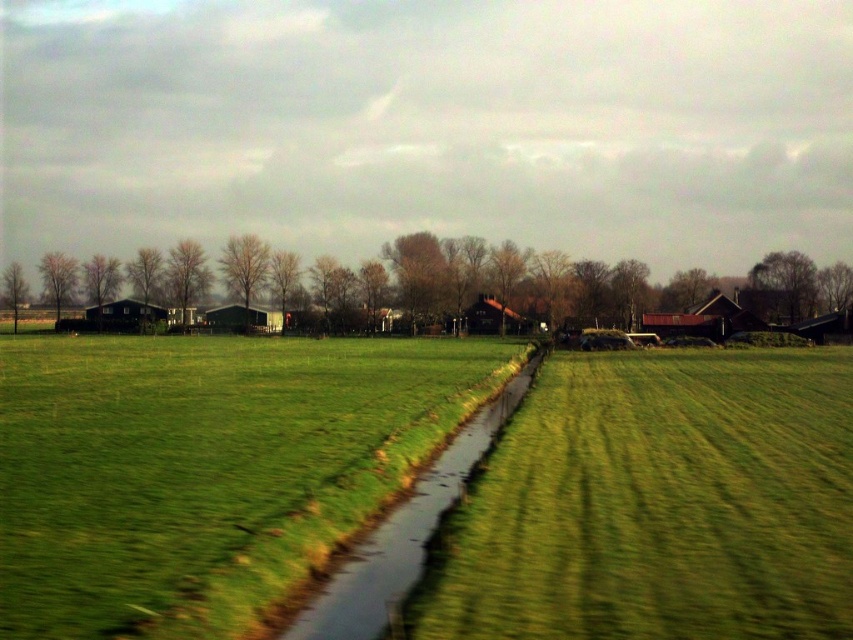
Can you confirm if green grassy field at center is positioned below green grassy stream at center?

No.

Which is more to the left, green grassy field at center or green grassy stream at center?

From the viewer's perspective, green grassy field at center appears more on the left side.

In order to click on green grassy field at center in this screenshot , I will do `click(206, 470)`.

Find the location of a particular element. This screenshot has width=853, height=640. green grassy field at center is located at coordinates (206, 470).